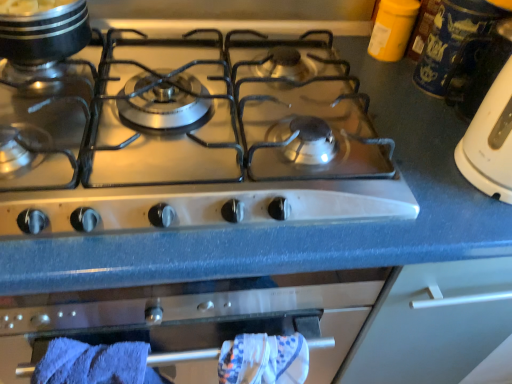
Question: Is shiny metallic pot at upper left far away from blue soft towel at lower left?

Choices:
 (A) no
 (B) yes

Answer: (A)

Question: Can you confirm if shiny metallic pot at upper left is taller than blue soft towel at lower left?

Choices:
 (A) no
 (B) yes

Answer: (A)

Question: From the image's perspective, would you say shiny metallic pot at upper left is positioned over blue soft towel at lower left?

Choices:
 (A) no
 (B) yes

Answer: (B)

Question: Considering the relative sizes of shiny metallic pot at upper left and blue soft towel at lower left in the image provided, is shiny metallic pot at upper left bigger than blue soft towel at lower left?

Choices:
 (A) no
 (B) yes

Answer: (A)

Question: From a real-world perspective, is shiny metallic pot at upper left positioned under blue soft towel at lower left based on gravity?

Choices:
 (A) no
 (B) yes

Answer: (A)

Question: Is shiny metallic pot at upper left closer to camera compared to blue soft towel at lower left?

Choices:
 (A) yes
 (B) no

Answer: (B)

Question: Could you tell me if shiny metallic pot at upper left is turned towards satin silver gas stove at center?

Choices:
 (A) no
 (B) yes

Answer: (A)

Question: Is shiny metallic pot at upper left positioned beyond the bounds of satin silver gas stove at center?

Choices:
 (A) no
 (B) yes

Answer: (B)

Question: From a real-world perspective, is shiny metallic pot at upper left on top of satin silver gas stove at center?

Choices:
 (A) no
 (B) yes

Answer: (B)

Question: From the image's perspective, does shiny metallic pot at upper left appear higher than satin silver gas stove at center?

Choices:
 (A) no
 (B) yes

Answer: (B)

Question: From a real-world perspective, is shiny metallic pot at upper left positioned under satin silver gas stove at center based on gravity?

Choices:
 (A) yes
 (B) no

Answer: (B)

Question: Considering the relative sizes of shiny metallic pot at upper left and satin silver gas stove at center in the image provided, is shiny metallic pot at upper left thinner than satin silver gas stove at center?

Choices:
 (A) yes
 (B) no

Answer: (A)

Question: Is blue ceramic mug at upper right turned away from blue soft towel at lower left?

Choices:
 (A) no
 (B) yes

Answer: (A)